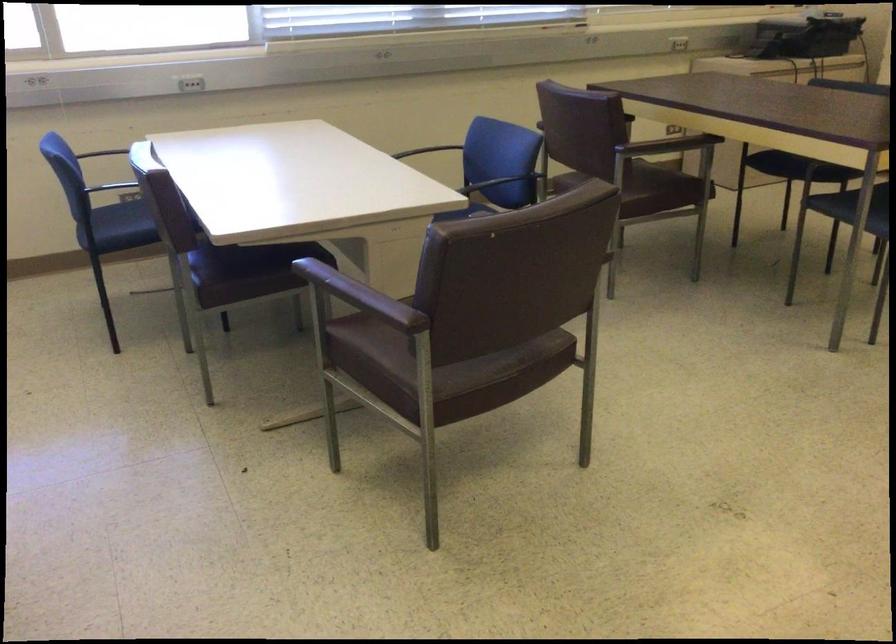
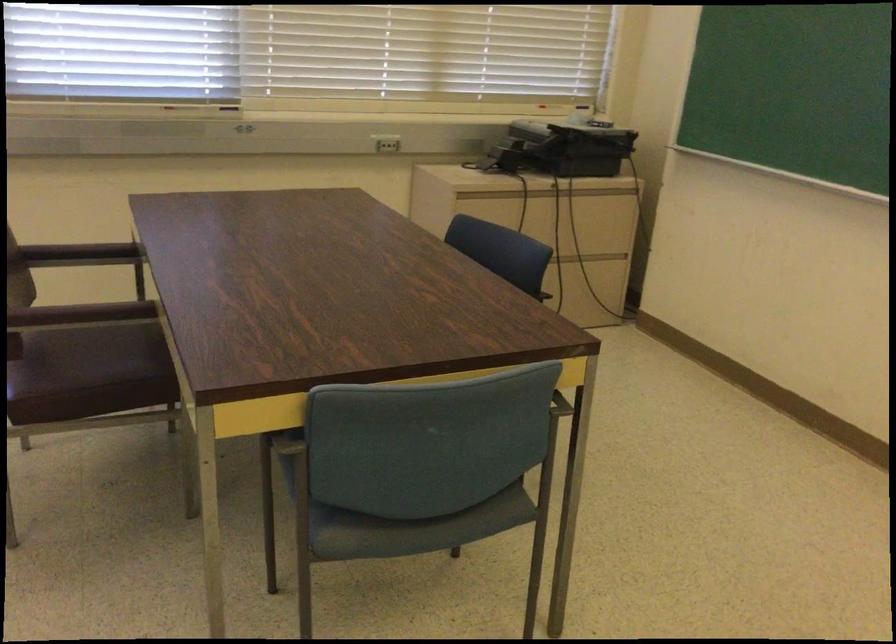
The images are taken continuously from a first-person perspective. In which direction are you moving?

The cameraman moved toward right, forward.